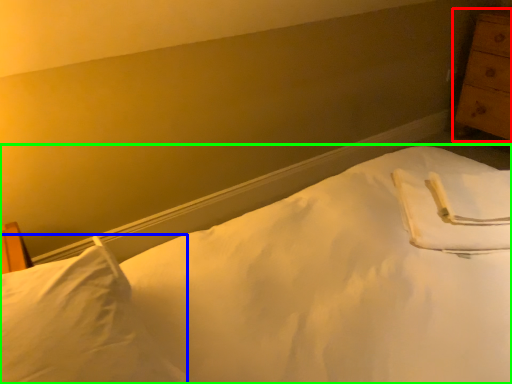
Question: Based on their relative distances, which object is farther from chest of drawers (highlighted by a red box)? Choose from pillow (highlighted by a blue box) and bed (highlighted by a green box).

Choices:
 (A) pillow
 (B) bed

Answer: (A)